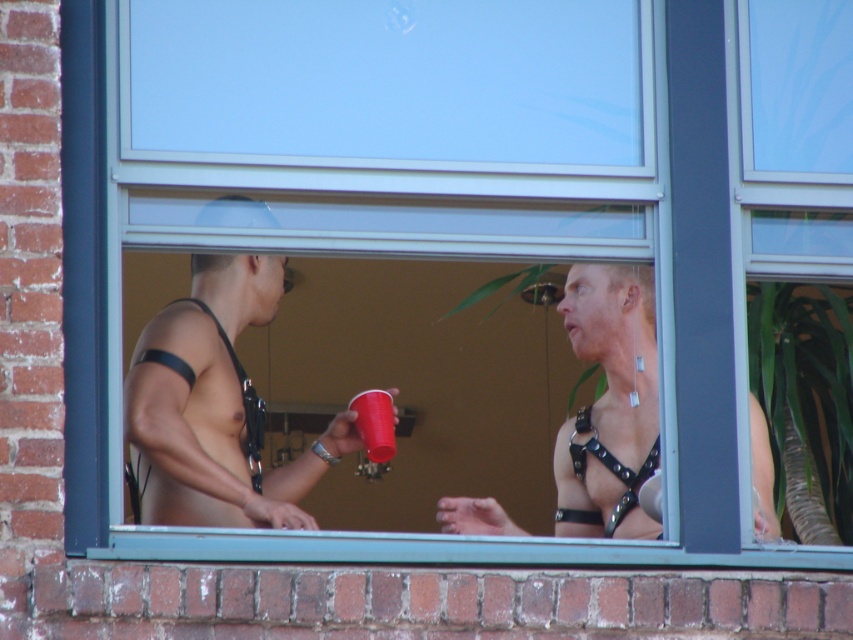
Question: Can you confirm if black leather harness at center is bigger than red plastic cup at center?

Choices:
 (A) no
 (B) yes

Answer: (B)

Question: Which object is the closest to the matte black harness at center?

Choices:
 (A) black leather harness at center
 (B) red plastic cup at center

Answer: (B)

Question: Based on their relative distances, which object is farther from the matte black harness at center?

Choices:
 (A) black leather harness at center
 (B) red plastic cup at center

Answer: (A)

Question: Which point is closer to the camera taking this photo?

Choices:
 (A) (263, 273)
 (B) (376, 436)

Answer: (B)

Question: Is matte black harness at center smaller than black leather harness at center?

Choices:
 (A) yes
 (B) no

Answer: (B)

Question: Is matte black harness at center below red plastic cup at center?

Choices:
 (A) no
 (B) yes

Answer: (A)